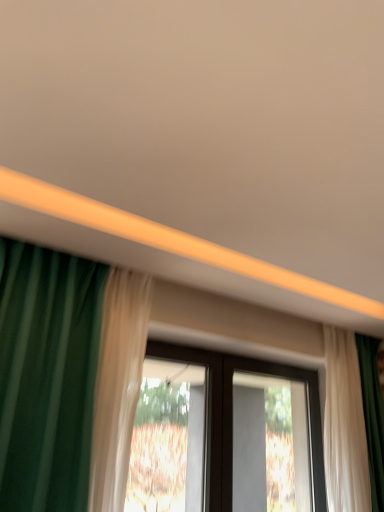
Question: Can you confirm if transparent glass window at center is positioned to the left of white sheer curtain at right?

Choices:
 (A) no
 (B) yes

Answer: (B)

Question: Is transparent glass window at center outside of white sheer curtain at right?

Choices:
 (A) yes
 (B) no

Answer: (A)

Question: Is transparent glass window at center facing towards white sheer curtain at right?

Choices:
 (A) yes
 (B) no

Answer: (B)

Question: Is transparent glass window at center in front of white sheer curtain at right?

Choices:
 (A) no
 (B) yes

Answer: (B)

Question: Are transparent glass window at center and white sheer curtain at right located far from each other?

Choices:
 (A) yes
 (B) no

Answer: (B)

Question: From the image's perspective, is black plastic screen door at center positioned above or below white sheer curtain at right?

Choices:
 (A) above
 (B) below

Answer: (B)

Question: Considering the positions of point (269, 462) and point (355, 503), is point (269, 462) closer or farther from the camera than point (355, 503)?

Choices:
 (A) closer
 (B) farther

Answer: (B)

Question: Considering the positions of black plastic screen door at center and white sheer curtain at right in the image, is black plastic screen door at center wider or thinner than white sheer curtain at right?

Choices:
 (A) wide
 (B) thin

Answer: (B)

Question: Choose the correct answer: Is black plastic screen door at center inside white sheer curtain at right or outside it?

Choices:
 (A) outside
 (B) inside

Answer: (A)

Question: Considering the positions of transparent glass window at center and white sheer curtain at right in the image, is transparent glass window at center wider or thinner than white sheer curtain at right?

Choices:
 (A) thin
 (B) wide

Answer: (A)

Question: In the image, is transparent glass window at center on the left side or the right side of white sheer curtain at right?

Choices:
 (A) right
 (B) left

Answer: (B)

Question: Looking at the image, does transparent glass window at center seem bigger or smaller compared to white sheer curtain at right?

Choices:
 (A) small
 (B) big

Answer: (A)

Question: Considering the positions of point (319, 454) and point (350, 453), is point (319, 454) closer or farther from the camera than point (350, 453)?

Choices:
 (A) farther
 (B) closer

Answer: (A)

Question: Is black plastic screen door at center to the left or to the right of transparent glass window at center in the image?

Choices:
 (A) right
 (B) left

Answer: (A)

Question: From a real-world perspective, relative to transparent glass window at center, is black plastic screen door at center vertically above or below?

Choices:
 (A) above
 (B) below

Answer: (B)